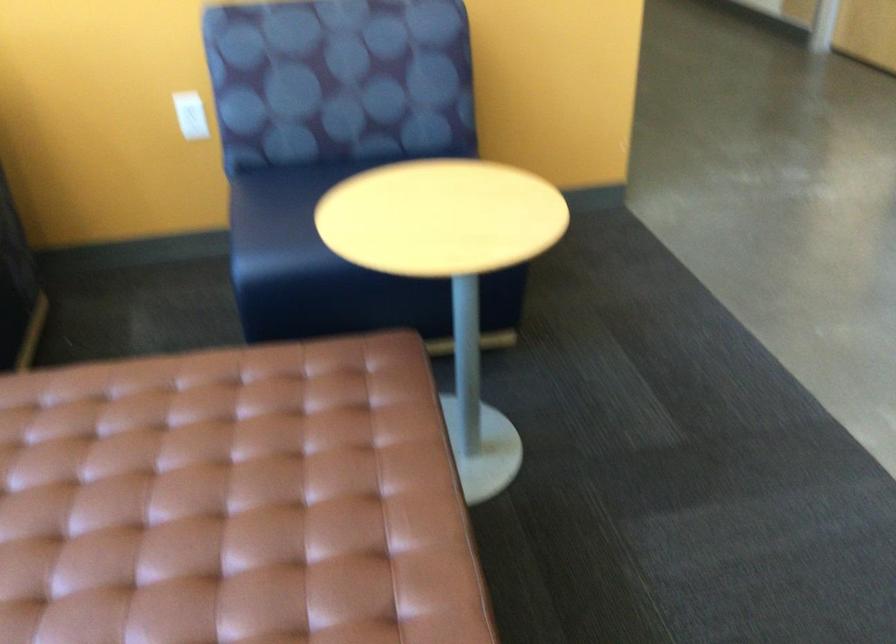
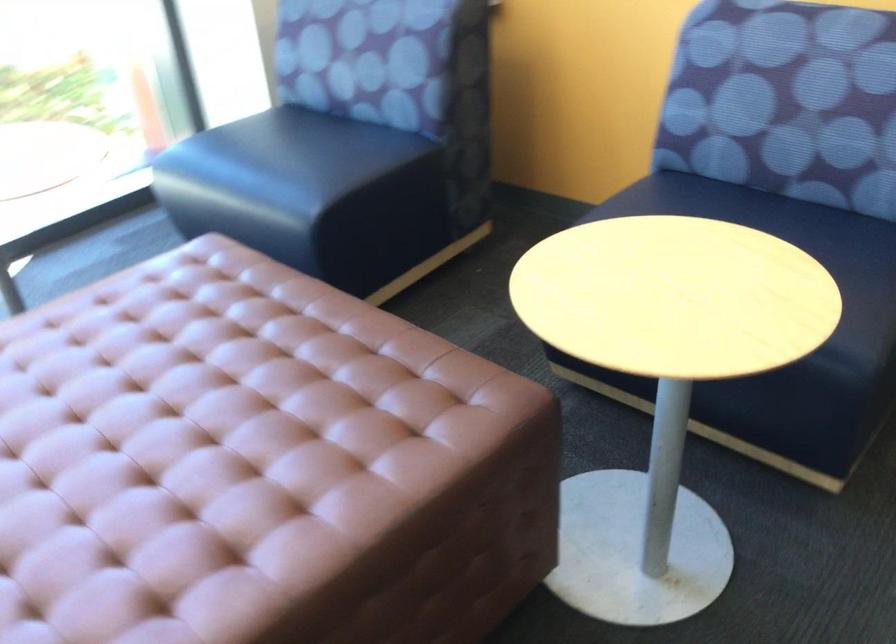
Question: The camera is either moving clockwise (left) or counter-clockwise (right) around the object. The first image is from the beginning of the video and the second image is from the end. Is the camera moving left or right when shooting the video?

Choices:
 (A) Left
 (B) Right

Answer: (B)